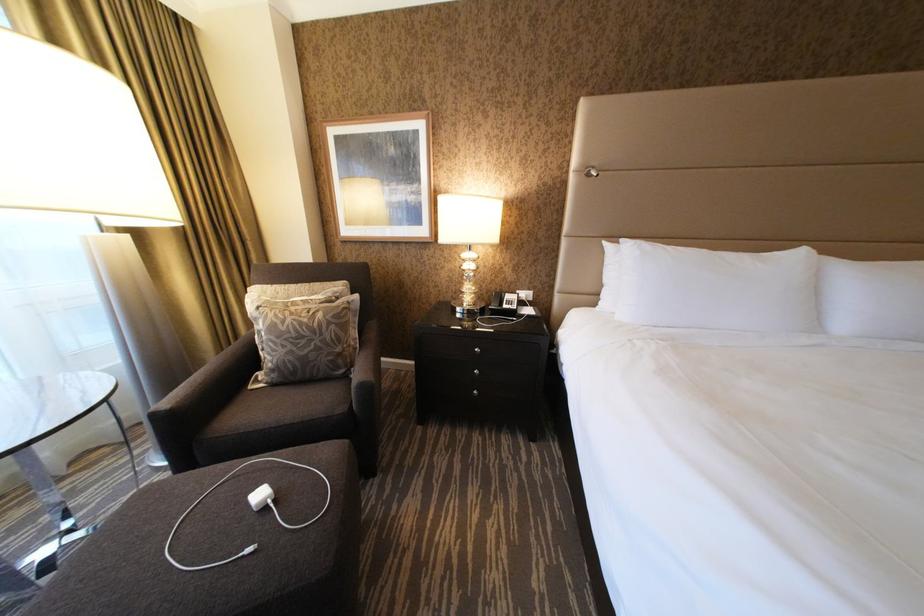
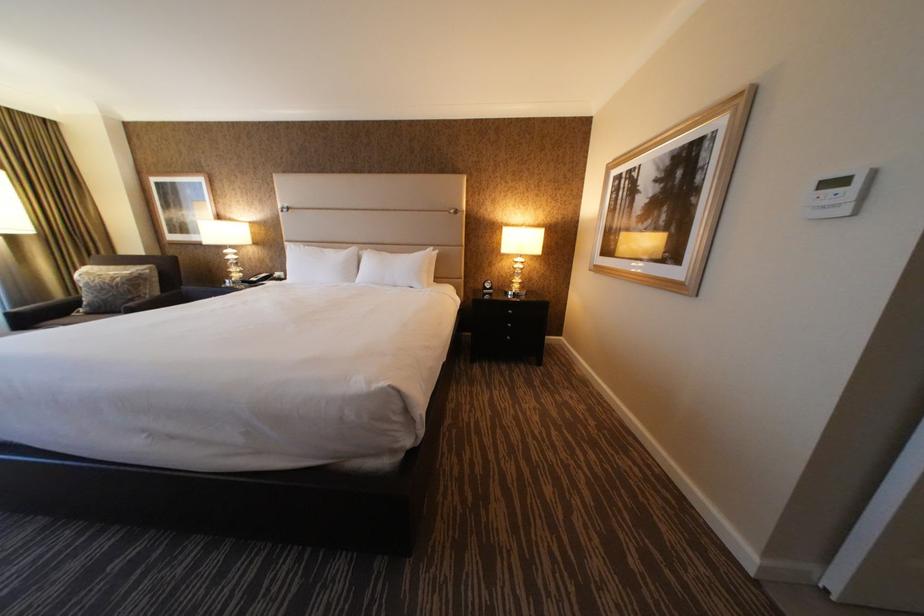
In a continuous first-person perspective shot, in which direction is the camera moving?

The cameraman moved toward right, backward.